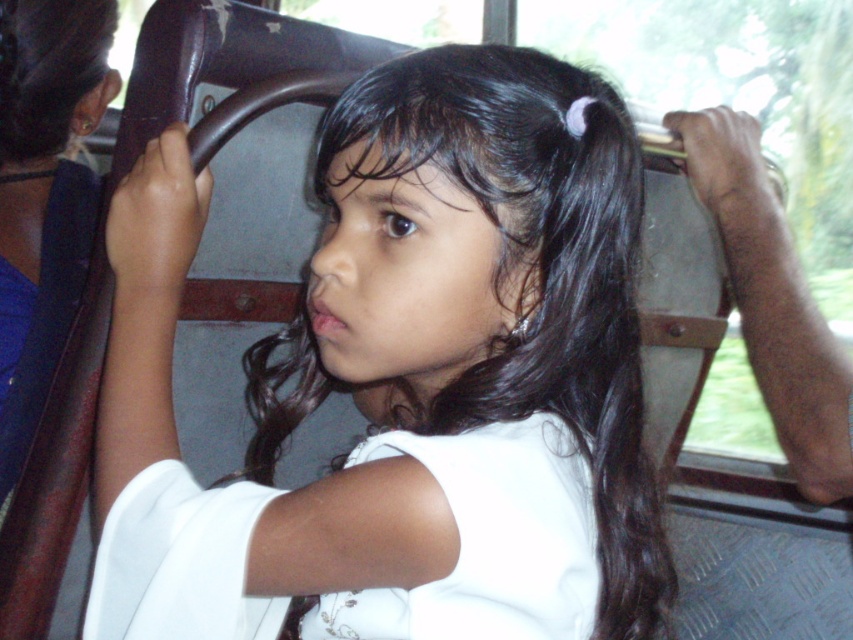
Between point (469, 360) and point (850, 467), which one is positioned in front?

Positioned in front is point (469, 360).

Is black hair at center bigger than metallic gray coach at right?

Indeed, black hair at center has a larger size compared to metallic gray coach at right.

Locate an element on the screen. Image resolution: width=853 pixels, height=640 pixels. black hair at center is located at coordinates (405, 380).